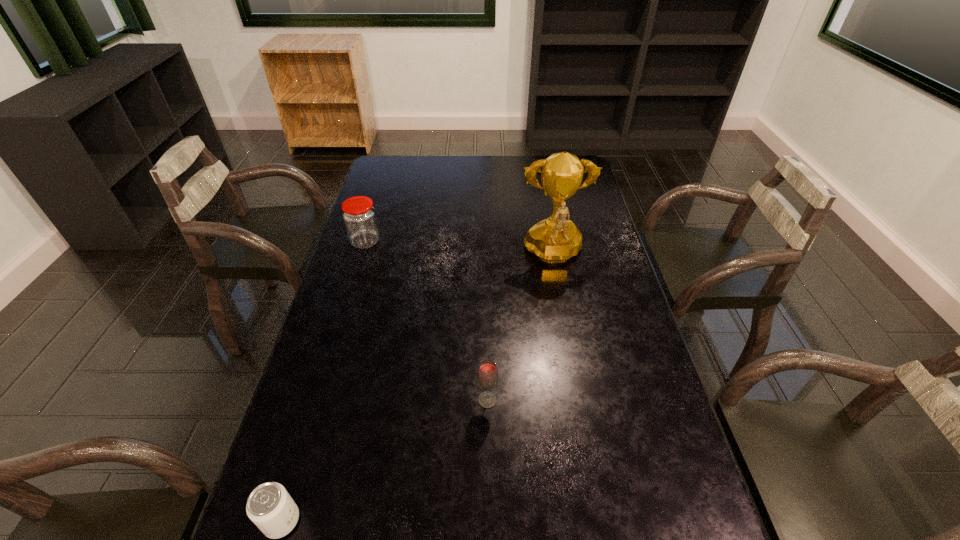
Locate an element on the screen. This screenshot has height=540, width=960. vacant space at the far edge of the desktop is located at coordinates (541, 183).

This screenshot has width=960, height=540. In order to click on vacant area at the left edge in this screenshot , I will do `click(393, 215)`.

Identify the location of free location at the right edge of the desktop. This screenshot has height=540, width=960. (588, 201).

Locate an element on the screen. free location at the far left corner is located at coordinates (393, 181).

Where is `unoccupied area between the jar and the third object from left to right`? Image resolution: width=960 pixels, height=540 pixels. unoccupied area between the jar and the third object from left to right is located at coordinates click(x=426, y=321).

Where is `free space between the tallest object and the jar`? free space between the tallest object and the jar is located at coordinates point(459,248).

You are a GUI agent. You are given a task and a screenshot of the screen. Output one action in this format:
    pyautogui.click(x=<x>, y=<y>)
    Task: Click on the unoccupied area between the second object from right to left and the rightmost object
    This screenshot has width=960, height=540.
    Given the screenshot: What is the action you would take?
    pyautogui.click(x=520, y=327)

Where is `vacant area that lies between the jar and the glass drink container`? This screenshot has width=960, height=540. vacant area that lies between the jar and the glass drink container is located at coordinates (426, 321).

The height and width of the screenshot is (540, 960). Find the location of `free spot between the rightmost object and the glass drink container`. free spot between the rightmost object and the glass drink container is located at coordinates (520, 327).

Locate an element on the screen. The image size is (960, 540). object that ranks as the closest to the rightmost object is located at coordinates (487, 376).